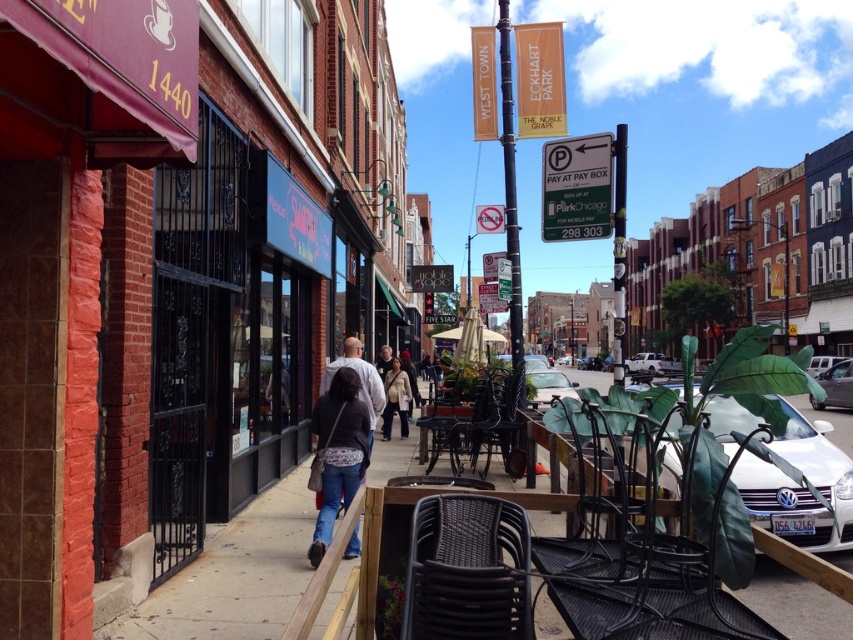
Question: Estimate the real-world distances between objects in this image. Which object is closer to the smooth concrete sidewalk at center?

Choices:
 (A) black metal chair at center
 (B) denim pants at center
 (C) light beige jacket at center
 (D) matte black awning at upper left

Answer: (A)

Question: Can you confirm if matte black awning at upper left is bigger than black metal chair at center?

Choices:
 (A) no
 (B) yes

Answer: (B)

Question: In this image, where is woven brown chair at lower center located relative to denim pants at center?

Choices:
 (A) above
 (B) below

Answer: (A)

Question: Which object appears closest to the camera in this image?

Choices:
 (A) black metal chair at center
 (B) metallic black chair at center

Answer: (B)

Question: Can you confirm if matte black awning at upper left is bigger than woven brown chair at lower center?

Choices:
 (A) yes
 (B) no

Answer: (A)

Question: Which of the following is the closest to the observer?

Choices:
 (A) (450, 493)
 (B) (822, 628)
 (C) (358, 550)
 (D) (480, 436)

Answer: (A)